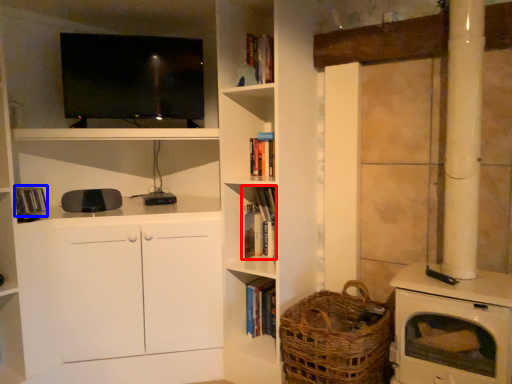
Question: Which point is further to the camera, book (highlighted by a red box) or book (highlighted by a blue box)?

Choices:
 (A) book
 (B) book

Answer: (A)